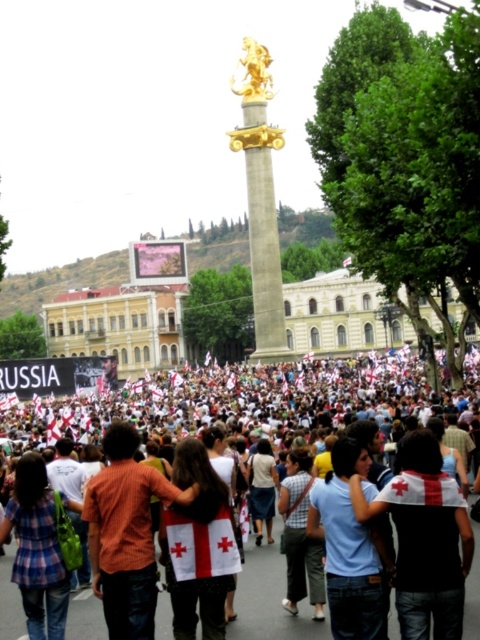
Question: Which point is farther from the camera taking this photo?

Choices:
 (A) (249, 42)
 (B) (33, 528)
 (C) (227, 512)
 (D) (290, 368)

Answer: (D)

Question: Which point appears closest to the camera in this image?

Choices:
 (A) (355, 556)
 (B) (245, 166)
 (C) (101, 508)
 (D) (431, 563)

Answer: (D)

Question: Which object is the closest to the gold polished metal column at center?

Choices:
 (A) white cotton shirt at center
 (B) white fabric crowd at center

Answer: (B)

Question: Can you confirm if plaid shirt at lower left is smaller than gold polished statue at center?

Choices:
 (A) no
 (B) yes

Answer: (A)

Question: Can you confirm if white fabric crowd at center is thinner than plaid shirt at lower left?

Choices:
 (A) yes
 (B) no

Answer: (B)

Question: Can you confirm if white fabric crowd at center is positioned below gold polished metal column at center?

Choices:
 (A) no
 (B) yes

Answer: (B)